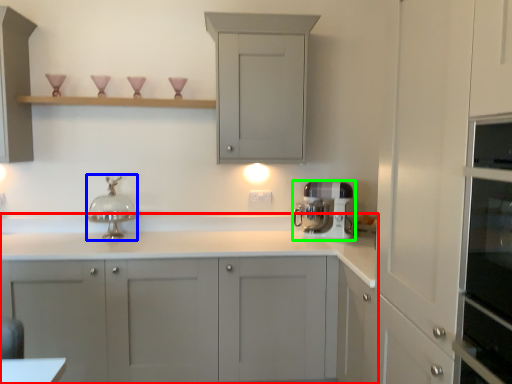
Question: Which object is the closest to the cabinetry (highlighted by a red box)? Choose among these: faucet (highlighted by a blue box) or home appliance (highlighted by a green box).

Choices:
 (A) faucet
 (B) home appliance

Answer: (B)